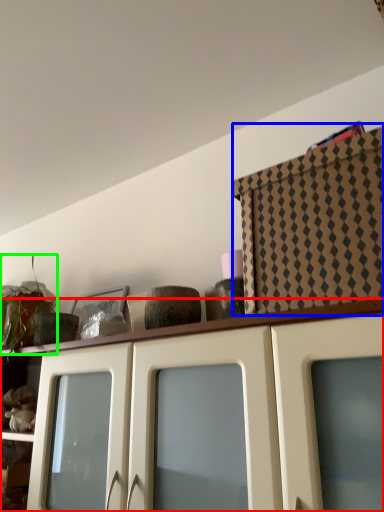
Question: Which is nearer to the cabinetry (highlighted by a red box)? cabinetry (highlighted by a blue box) or plant (highlighted by a green box).

Choices:
 (A) cabinetry
 (B) plant

Answer: (A)